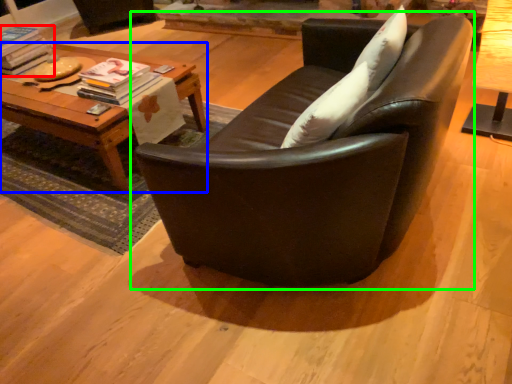
Question: Based on their relative distances, which object is farther from magazine (highlighted by a red box)? Choose from table (highlighted by a blue box) and studio couch (highlighted by a green box).

Choices:
 (A) table
 (B) studio couch

Answer: (B)